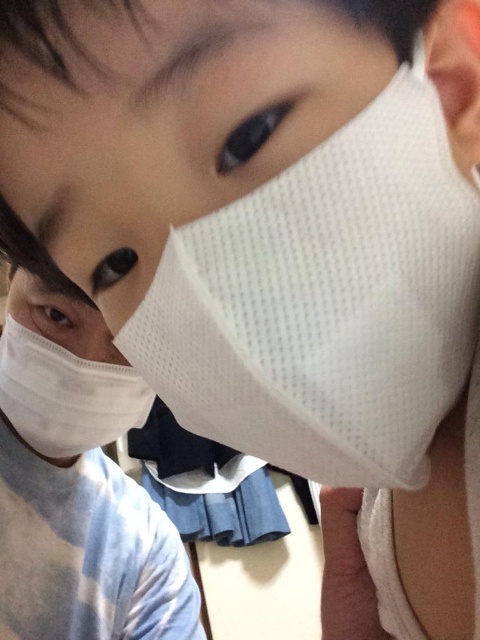
Question: Can you confirm if white mesh mask at left is positioned to the right of white mesh nose at center?

Choices:
 (A) yes
 (B) no

Answer: (B)

Question: Is white mesh mask at center to the left of white mesh mask at left from the viewer's perspective?

Choices:
 (A) no
 (B) yes

Answer: (A)

Question: Can you confirm if white mesh mask at center is wider than white mesh nose at center?

Choices:
 (A) no
 (B) yes

Answer: (B)

Question: Which point appears closest to the camera in this image?

Choices:
 (A) (328, 109)
 (B) (90, 358)

Answer: (A)

Question: Considering the real-world distances, which object is farthest from the white mesh mask at center?

Choices:
 (A) white mesh mask at left
 (B) white mesh nose at center

Answer: (B)

Question: Which is nearer to the white mesh mask at left?

Choices:
 (A) white mesh nose at center
 (B) white mesh mask at center

Answer: (A)